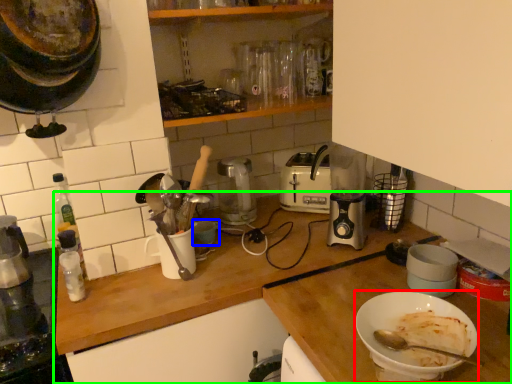
Question: Which is farther away from bowl (highlighted by a red box)? bowl (highlighted by a blue box) or countertop (highlighted by a green box)?

Choices:
 (A) bowl
 (B) countertop

Answer: (A)